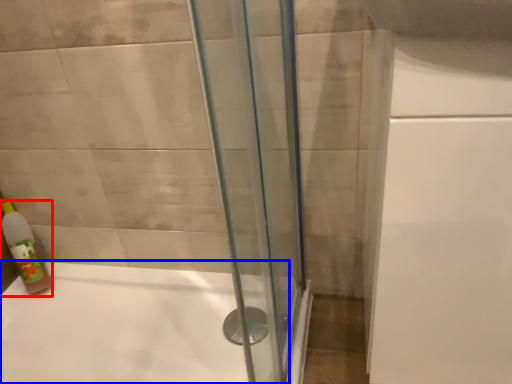
Question: Which point is closer to the camera, bottle (highlighted by a red box) or bathtub (highlighted by a blue box)?

Choices:
 (A) bottle
 (B) bathtub

Answer: (B)